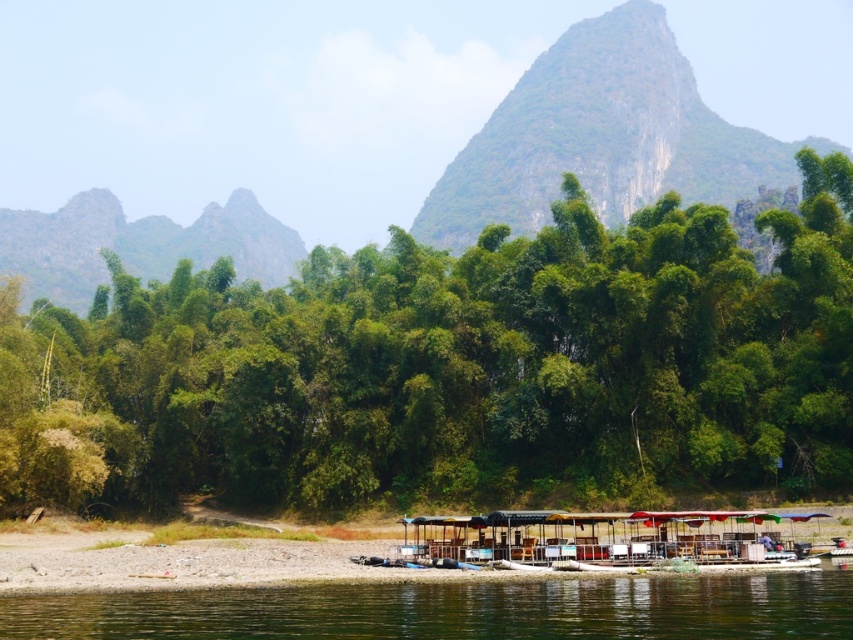
Does green leafy trees at center appear under green leafy mountain at upper center?

Indeed, green leafy trees at center is positioned under green leafy mountain at upper center.

Can you confirm if green leafy trees at center is positioned to the right of green leafy mountain at upper center?

In fact, green leafy trees at center is to the left of green leafy mountain at upper center.

Which is in front, point (363, 376) or point (579, 20)?

Point (363, 376)

The image size is (853, 640). Find the location of `green leafy trees at center`. green leafy trees at center is located at coordinates (459, 368).

Which of these two, green leafy trees at center or clear water at lower center, stands shorter?

clear water at lower center is shorter.

Does green leafy trees at center have a greater width compared to clear water at lower center?

Yes, green leafy trees at center is wider than clear water at lower center.

The height and width of the screenshot is (640, 853). In order to click on green leafy trees at center in this screenshot , I will do `click(459, 368)`.

Between green leafy mountain at upper center and wooden raft at lower center, which one appears on the right side from the viewer's perspective?

From the viewer's perspective, green leafy mountain at upper center appears more on the right side.

Between green leafy mountain at upper center and wooden raft at lower center, which one has less height?

Standing shorter between the two is wooden raft at lower center.

The height and width of the screenshot is (640, 853). What are the coordinates of `green leafy mountain at upper center` in the screenshot? It's located at (602, 136).

The image size is (853, 640). I want to click on green leafy mountain at upper center, so click(x=602, y=136).